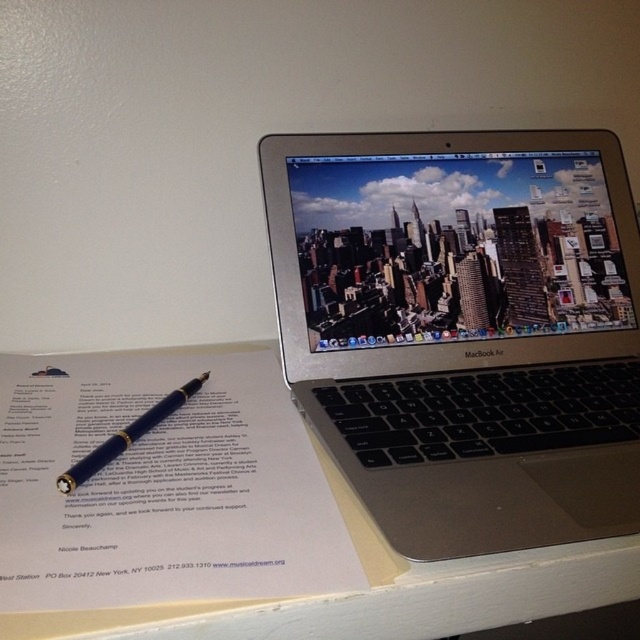
Between white matte table at center and blue polished pen at lower left, which one is positioned lower?

Positioned lower is white matte table at center.

Does point (227, 424) lie in front of point (134, 429)?

No, it is not.

Locate an element on the screen. This screenshot has width=640, height=640. white matte table at center is located at coordinates [x=241, y=518].

Does silver metallic laptop at upper right appear on the right side of blue polished pen at lower left?

Yes, silver metallic laptop at upper right is to the right of blue polished pen at lower left.

Is silver metallic laptop at upper right further to camera compared to blue polished pen at lower left?

No, it is not.

Between point (268, 189) and point (204, 380), which one is positioned behind?

The point (268, 189) is more distant.

This screenshot has width=640, height=640. I want to click on silver metallic laptop at upper right, so click(464, 328).

Is silver metallic laptop at upper right bigger than white matte table at center?

Indeed, silver metallic laptop at upper right has a larger size compared to white matte table at center.

Which is below, silver metallic laptop at upper right or white matte table at center?

white matte table at center

Is point (440, 324) behind point (221, 365)?

Yes, point (440, 324) is behind point (221, 365).

What are the coordinates of `silver metallic laptop at upper right` in the screenshot? It's located at (464, 328).